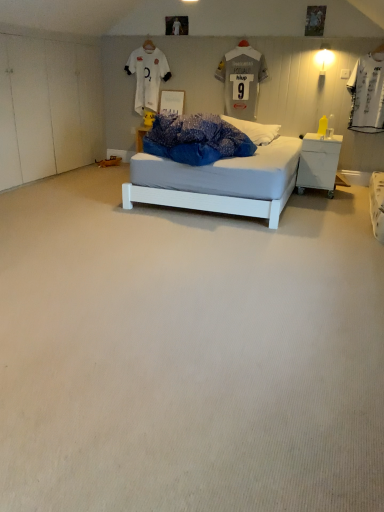
Question: In which direction should I rotate to look at white jersey at upper center, which is the 1th t shirt in left-to-right order?

Choices:
 (A) right
 (B) left

Answer: (B)

Question: Would you say white plastic nightstand at right is outside white jersey at upper center, which is the 1th t shirt in left-to-right order?

Choices:
 (A) yes
 (B) no

Answer: (A)

Question: From the image's perspective, is white plastic nightstand at right under white jersey at upper center, which is the 1th t shirt in left-to-right order?

Choices:
 (A) yes
 (B) no

Answer: (A)

Question: Does white plastic nightstand at right come in front of white jersey at upper center, which is the 1th t shirt in left-to-right order?

Choices:
 (A) yes
 (B) no

Answer: (A)

Question: Does white plastic nightstand at right have a lesser height compared to white jersey at upper center, which is the 1th t shirt in left-to-right order?

Choices:
 (A) yes
 (B) no

Answer: (A)

Question: Is white plastic nightstand at right oriented towards white jersey at upper center, which is the 1th t shirt in left-to-right order?

Choices:
 (A) no
 (B) yes

Answer: (A)

Question: From the image's perspective, would you say white plastic nightstand at right is positioned over white jersey at upper center, placed as the second t shirt when sorted from right to left?

Choices:
 (A) yes
 (B) no

Answer: (B)

Question: Does white jersey at upper center, which is the 1th t shirt in left-to-right order, have a lesser height compared to white carpet at center?

Choices:
 (A) no
 (B) yes

Answer: (A)

Question: From the image's perspective, does white jersey at upper center, placed as the second t shirt when sorted from right to left, appear higher than white carpet at center?

Choices:
 (A) yes
 (B) no

Answer: (A)

Question: Can you confirm if white jersey at upper center, which is the 1th t shirt in left-to-right order, is taller than white carpet at center?

Choices:
 (A) no
 (B) yes

Answer: (B)

Question: Is white jersey at upper center, which is the 1th t shirt in left-to-right order, placed right next to white carpet at center?

Choices:
 (A) no
 (B) yes

Answer: (A)

Question: Would you consider white jersey at upper center, placed as the second t shirt when sorted from right to left, to be distant from white carpet at center?

Choices:
 (A) no
 (B) yes

Answer: (B)

Question: From a real-world perspective, is white jersey at upper center, which is the 1th t shirt in left-to-right order, below white carpet at center?

Choices:
 (A) yes
 (B) no

Answer: (B)

Question: From the image's perspective, is white plastic nightstand at right below gray fabric jersey at upper center, which ranks as the second t shirt in left-to-right order?

Choices:
 (A) yes
 (B) no

Answer: (A)